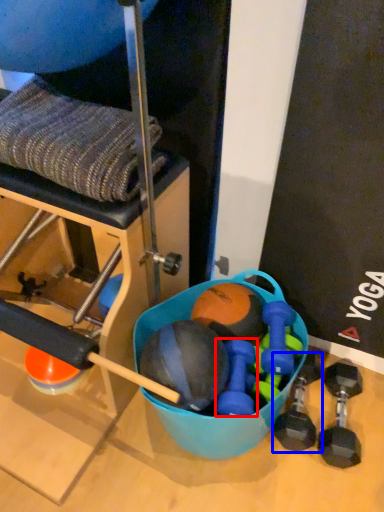
Question: Which object appears closest to the camera in this image, dumbbell (highlighted by a red box) or dumbbell (highlighted by a blue box)?

Choices:
 (A) dumbbell
 (B) dumbbell

Answer: (A)